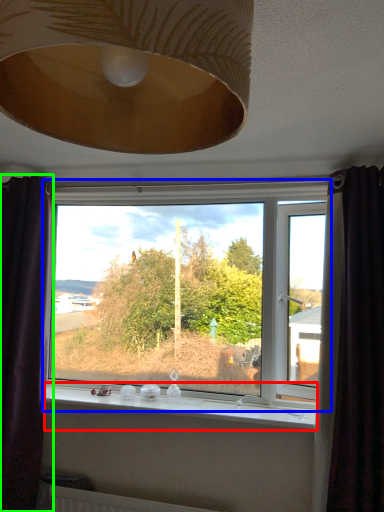
Question: Considering the real-world distances, which object is closest to window sill (highlighted by a red box)? window (highlighted by a blue box) or curtain (highlighted by a green box).

Choices:
 (A) window
 (B) curtain

Answer: (A)